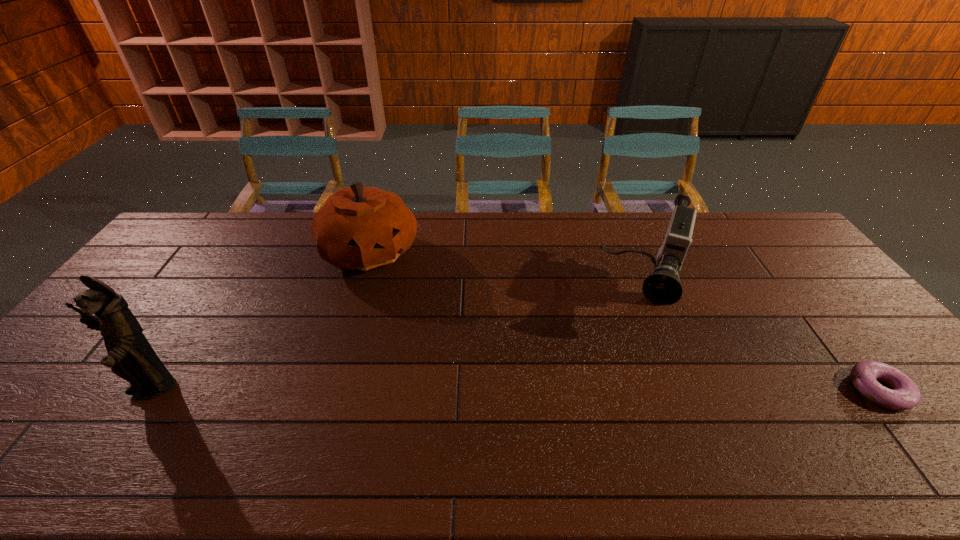
Locate an element on the screen. unoccupied area between the pumpkin and the camcorder is located at coordinates (508, 275).

This screenshot has width=960, height=540. Identify the location of free space between the doughnut and the second object from right to left. (762, 345).

At what (x,y) coordinates should I click in order to perform the action: click on object that ranks as the third closest to the figurine. Please return your answer as a coordinate pair (x, y). The width and height of the screenshot is (960, 540). Looking at the image, I should click on (904, 394).

Select which object is the third closest to the doughnut. Please provide its 2D coordinates. Your answer should be formatted as a tuple, i.e. [(x, y)], where the tuple contains the x and y coordinates of a point satisfying the conditions above.

[(130, 356)]

This screenshot has width=960, height=540. I want to click on vacant region that satisfies the following two spatial constraints: 1. on the front side of the rightmost object; 2. on the left side of the third object from right to left, so click(328, 390).